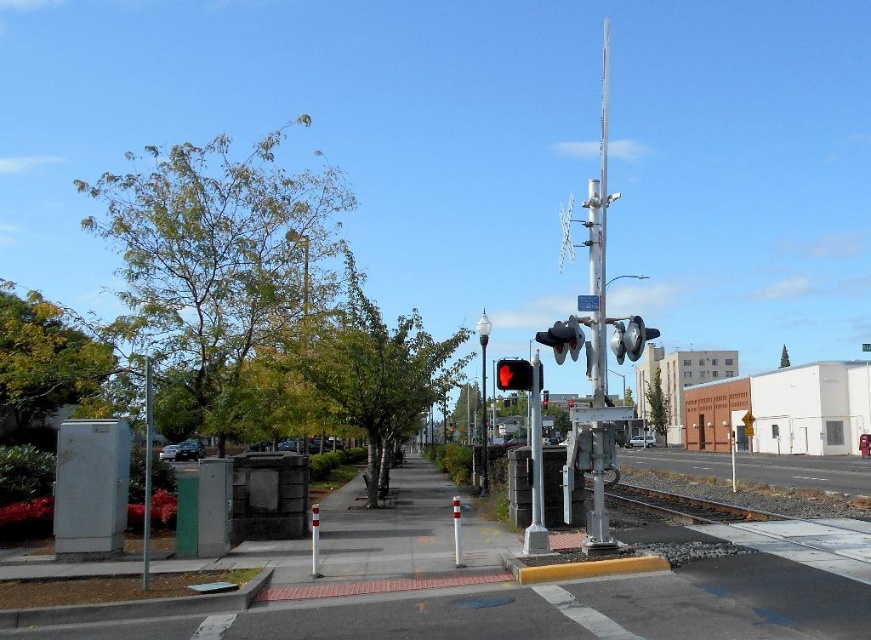
Looking at this image, between green textured utility pole at left and red matte traffic light at center, which one is positioned lower?

green textured utility pole at left is lower down.

The width and height of the screenshot is (871, 640). Describe the element at coordinates (147, 474) in the screenshot. I see `green textured utility pole at left` at that location.

Describe the element at coordinates (147, 474) in the screenshot. I see `green textured utility pole at left` at that location.

This screenshot has width=871, height=640. Identify the location of green textured utility pole at left. (147, 474).

What do you see at coordinates (598, 244) in the screenshot? I see `silver metallic pole at right` at bounding box center [598, 244].

Which is above, silver metallic pole at right or red matte traffic light at center?

Positioned higher is silver metallic pole at right.

Where is `silver metallic pole at right`? The width and height of the screenshot is (871, 640). silver metallic pole at right is located at coordinates (598, 244).

Identify the location of silver metallic pole at right. (598, 244).

The image size is (871, 640). What do you see at coordinates (598, 244) in the screenshot?
I see `silver metallic pole at right` at bounding box center [598, 244].

Is silver metallic pole at right taller than green textured utility pole at left?

Correct, silver metallic pole at right is much taller as green textured utility pole at left.

Is point (601, 220) positioned after point (149, 476)?

That is True.

Locate an element on the screen. This screenshot has height=640, width=871. silver metallic pole at right is located at coordinates (598, 244).